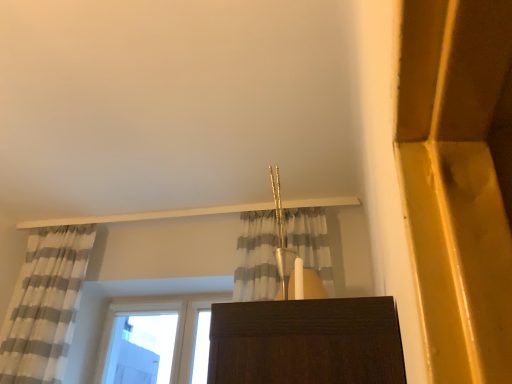
Locate an element on the screen. Image resolution: width=512 pixels, height=384 pixels. white striped fabric at left is located at coordinates (45, 305).

Measure the distance between white striped fabric at left and camera.

The distance of white striped fabric at left from camera is 8.07 feet.

Describe the element at coordinates (45, 305) in the screenshot. I see `white striped fabric at left` at that location.

What are the coordinates of `white striped fabric at left` in the screenshot? It's located at (45, 305).